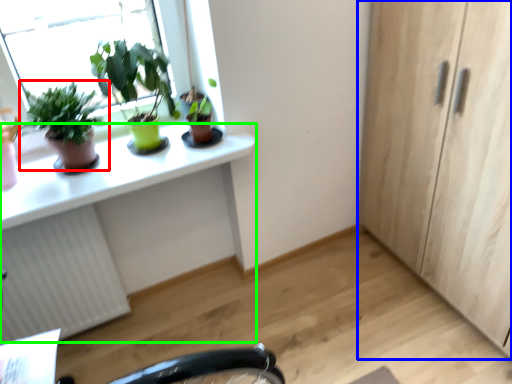
Question: Estimate the real-world distances between objects in this image. Which object is closer to houseplant (highlighted by a red box), cabinetry (highlighted by a blue box) or computer desk (highlighted by a green box)?

Choices:
 (A) cabinetry
 (B) computer desk

Answer: (B)